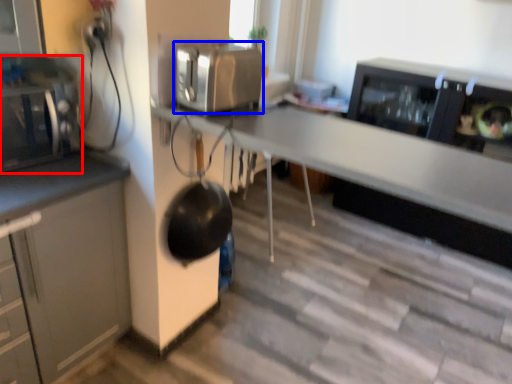
Question: Which object is closer to the camera taking this photo, home appliance (highlighted by a red box) or kitchen appliance (highlighted by a blue box)?

Choices:
 (A) home appliance
 (B) kitchen appliance

Answer: (B)